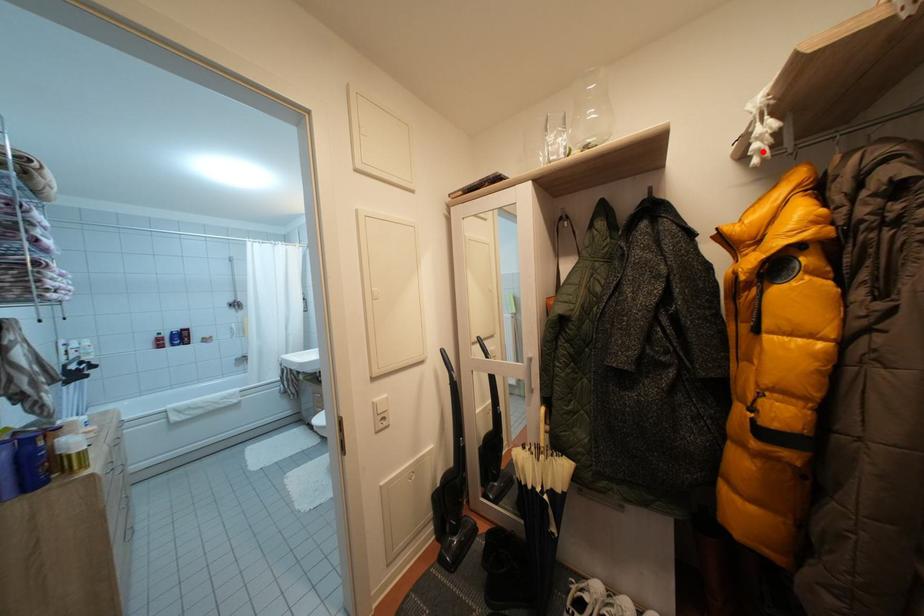
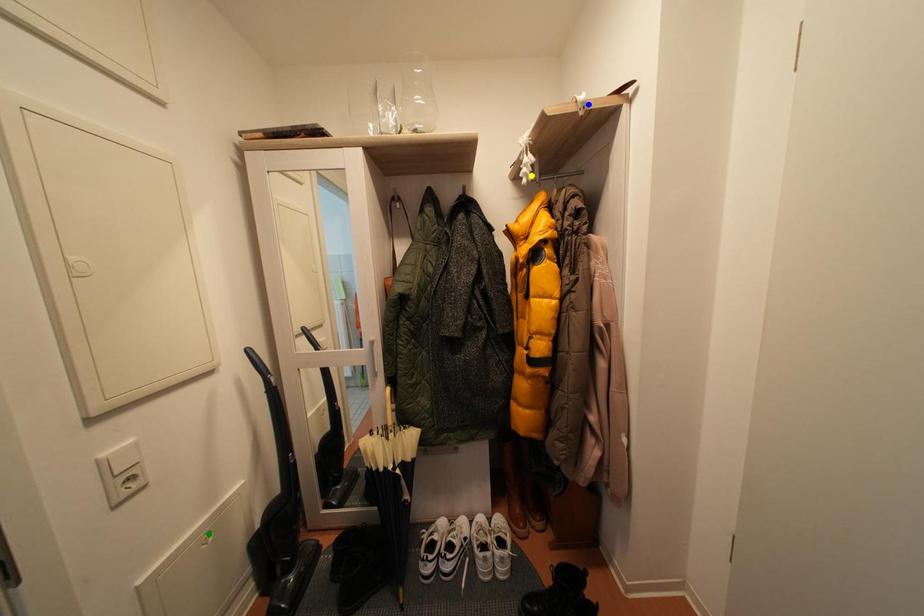
Question: I am providing you with two images of the same scene from different viewpoints. A red point is marked on the first image. You are given multiple points on the second image. In image 2, which mark is for the same physical point as the one in image 1?

Choices:
 (A) yellow point
 (B) green point
 (C) blue point

Answer: (A)